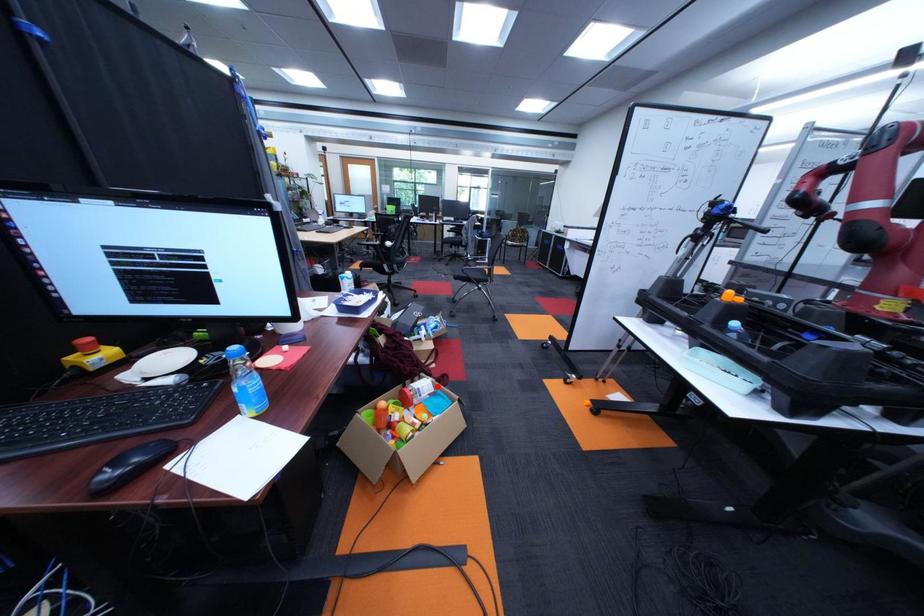
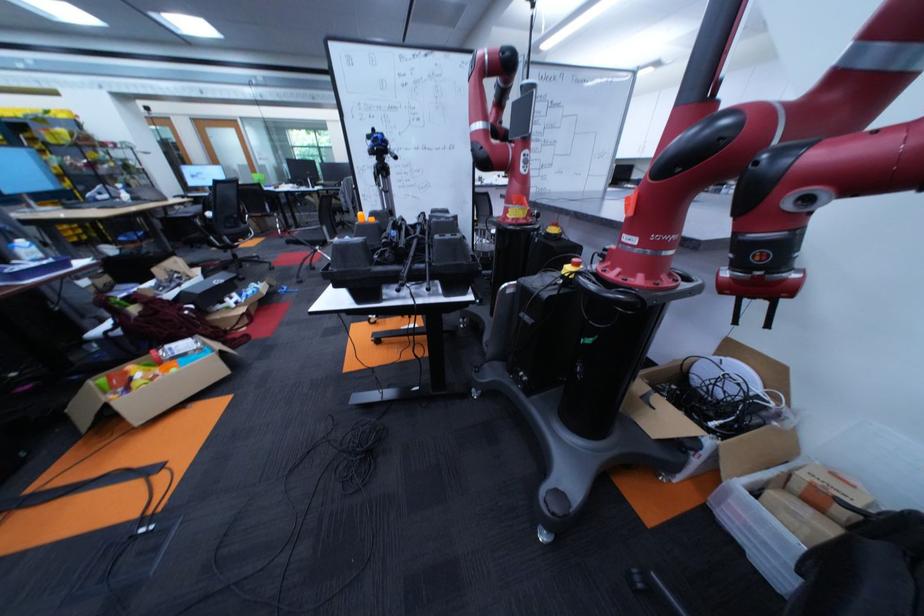
Find the pixel in the second image that matches the highlighted location in the first image.

(198, 345)